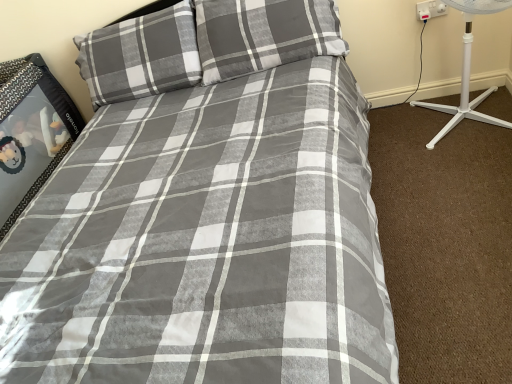
This screenshot has width=512, height=384. In order to click on free space that is to the left of white plastic fan at right in this screenshot , I will do `click(393, 155)`.